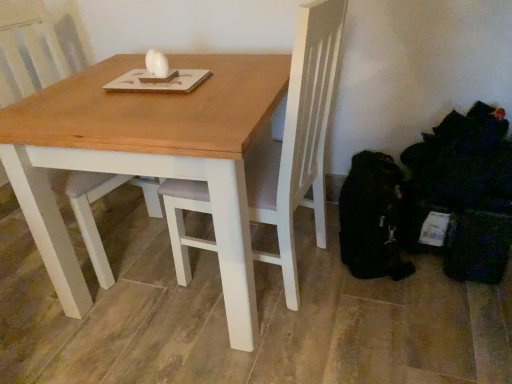
Question: Does white wood chair at center lie in front of wooden table at center?

Choices:
 (A) no
 (B) yes

Answer: (A)

Question: From the image's perspective, is white wood chair at center under wooden table at center?

Choices:
 (A) yes
 (B) no

Answer: (B)

Question: Considering the relative sizes of white wood chair at center and wooden table at center in the image provided, is white wood chair at center shorter than wooden table at center?

Choices:
 (A) no
 (B) yes

Answer: (A)

Question: Can you confirm if white wood chair at center is smaller than wooden table at center?

Choices:
 (A) yes
 (B) no

Answer: (A)

Question: Considering the relative sizes of white wood chair at center and wooden table at center in the image provided, is white wood chair at center wider than wooden table at center?

Choices:
 (A) no
 (B) yes

Answer: (A)

Question: Could you tell me if white wood chair at center is turned towards wooden table at center?

Choices:
 (A) yes
 (B) no

Answer: (A)

Question: Can you confirm if wooden table at center is bigger than white wood chair at center?

Choices:
 (A) yes
 (B) no

Answer: (A)

Question: From the image's perspective, is wooden table at center under white wood chair at center?

Choices:
 (A) no
 (B) yes

Answer: (B)

Question: Is wooden table at center in front of white wood chair at center?

Choices:
 (A) no
 (B) yes

Answer: (B)

Question: From a real-world perspective, is wooden table at center positioned over white wood chair at center based on gravity?

Choices:
 (A) yes
 (B) no

Answer: (B)

Question: Considering the relative sizes of wooden table at center and white wood chair at center in the image provided, is wooden table at center smaller than white wood chair at center?

Choices:
 (A) no
 (B) yes

Answer: (A)

Question: Is wooden table at center surrounding white wood chair at center?

Choices:
 (A) no
 (B) yes

Answer: (A)

Question: In terms of height, does wooden table at center look taller or shorter compared to white wood chair at center?

Choices:
 (A) tall
 (B) short

Answer: (B)